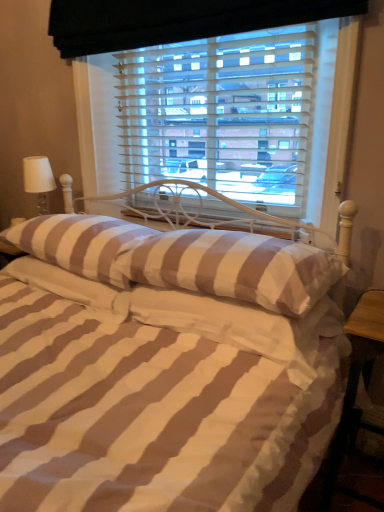
Question: Is wooden table at lower right not close to brown striped pillow at center, which is counted as the 2th pillow, starting from the right?

Choices:
 (A) yes
 (B) no

Answer: (B)

Question: Does wooden table at lower right have a greater width compared to brown striped pillow at center, which is the 3th pillow from left to right?

Choices:
 (A) yes
 (B) no

Answer: (B)

Question: Does wooden table at lower right come behind brown striped pillow at center, which is the 3th pillow from left to right?

Choices:
 (A) yes
 (B) no

Answer: (A)

Question: Considering the relative positions of wooden table at lower right and brown striped pillow at center, which is counted as the 2th pillow, starting from the right, in the image provided, is wooden table at lower right to the right of brown striped pillow at center, which is counted as the 2th pillow, starting from the right, from the viewer's perspective?

Choices:
 (A) yes
 (B) no

Answer: (A)

Question: Is wooden table at lower right smaller than brown striped pillow at center, which is counted as the 2th pillow, starting from the right?

Choices:
 (A) no
 (B) yes

Answer: (B)

Question: Is wooden table at lower right facing away from brown striped pillow at center, which is counted as the 2th pillow, starting from the right?

Choices:
 (A) yes
 (B) no

Answer: (B)

Question: From a real-world perspective, does brown striped pillow at center, the 4th pillow in the right-to-left sequence, sit lower than wooden table at lower right?

Choices:
 (A) yes
 (B) no

Answer: (B)

Question: Is brown striped pillow at center, the 4th pillow in the right-to-left sequence, outside wooden table at lower right?

Choices:
 (A) no
 (B) yes

Answer: (B)

Question: Can you confirm if brown striped pillow at center, marked as the 1th pillow in a left-to-right arrangement, is positioned to the right of wooden table at lower right?

Choices:
 (A) no
 (B) yes

Answer: (A)

Question: Is brown striped pillow at center, marked as the 1th pillow in a left-to-right arrangement, far away from wooden table at lower right?

Choices:
 (A) no
 (B) yes

Answer: (A)

Question: Is brown striped pillow at center, marked as the 1th pillow in a left-to-right arrangement, taller than wooden table at lower right?

Choices:
 (A) yes
 (B) no

Answer: (B)

Question: Considering the relative sizes of brown striped pillow at center, the 4th pillow in the right-to-left sequence, and wooden table at lower right in the image provided, is brown striped pillow at center, the 4th pillow in the right-to-left sequence, smaller than wooden table at lower right?

Choices:
 (A) yes
 (B) no

Answer: (A)

Question: Are brown striped pillow at center, which ranks as the second pillow in left-to-right order, and brown striped pillow at center, which is the 3th pillow from left to right, located far from each other?

Choices:
 (A) yes
 (B) no

Answer: (B)